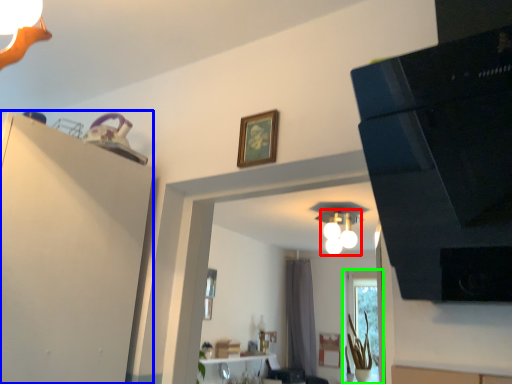
Question: Which is farther away from light fixture (highlighted by a red box)? dresser (highlighted by a blue box) or window (highlighted by a green box)?

Choices:
 (A) dresser
 (B) window

Answer: (A)